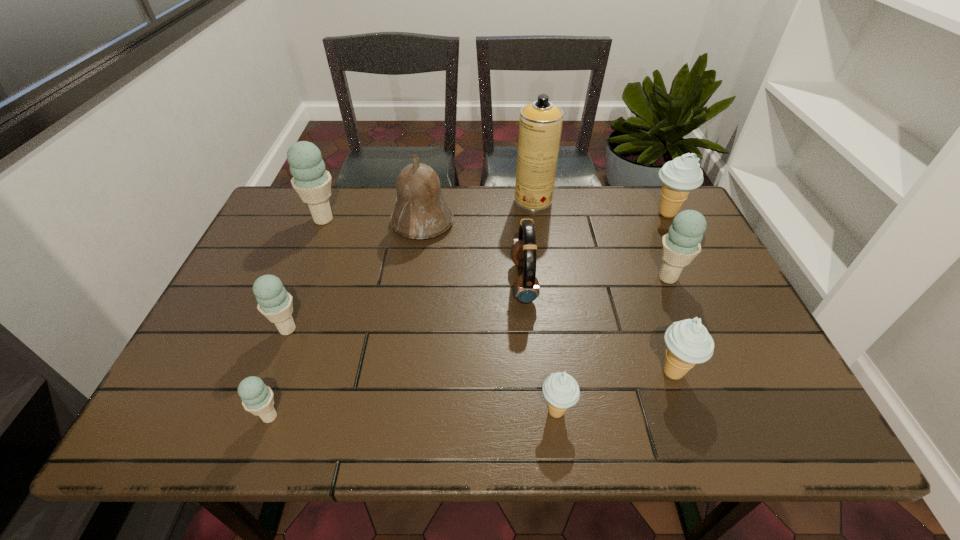
Where is `free space located 0.250m on the left of the rightmost blue ice cream`? Image resolution: width=960 pixels, height=540 pixels. free space located 0.250m on the left of the rightmost blue ice cream is located at coordinates (555, 278).

I want to click on blank space located 0.300m on the ear cup of the headset, so click(396, 283).

Locate an element on the screen. The image size is (960, 540). free location located on the ear cup of the headset is located at coordinates (373, 283).

Locate an element on the screen. This screenshot has height=540, width=960. free space located on the ear cup of the headset is located at coordinates (412, 283).

This screenshot has height=540, width=960. In order to click on free space located on the right of the eighth farthest object in this screenshot , I will do `click(732, 372)`.

Find the location of `free space located on the right of the seventh farthest object`. free space located on the right of the seventh farthest object is located at coordinates (460, 329).

This screenshot has height=540, width=960. Identify the location of vacant space located on the left of the fourth ice cream from left to right. [x=430, y=411].

Identify the location of free spot located on the right of the nearest blue ice cream. The image size is (960, 540). pyautogui.click(x=368, y=417).

In order to click on aerosol can present at the far edge in this screenshot , I will do `click(540, 126)`.

The width and height of the screenshot is (960, 540). Find the location of `bell that is at the far edge`. bell that is at the far edge is located at coordinates (421, 212).